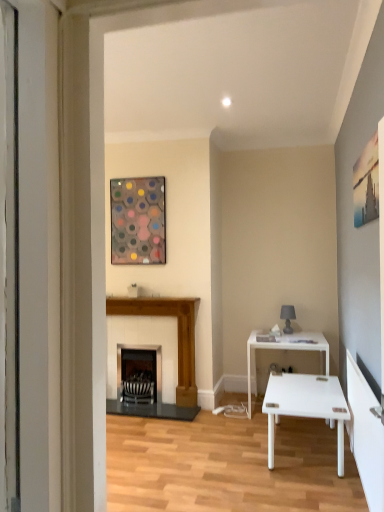
Question: Does matte gray lampshade at right have a greater width compared to black striped fireplace at center, the first fireplace positioned from the left?

Choices:
 (A) yes
 (B) no

Answer: (B)

Question: Is matte gray lampshade at right aimed at black striped fireplace at center, the first fireplace positioned from the left?

Choices:
 (A) yes
 (B) no

Answer: (B)

Question: Considering the relative sizes of matte gray lampshade at right and black striped fireplace at center, the first fireplace positioned from the left, in the image provided, is matte gray lampshade at right bigger than black striped fireplace at center, the first fireplace positioned from the left,?

Choices:
 (A) yes
 (B) no

Answer: (B)

Question: Is matte gray lampshade at right shorter than black striped fireplace at center, acting as the second fireplace starting from the right?

Choices:
 (A) no
 (B) yes

Answer: (B)

Question: From a real-world perspective, is matte gray lampshade at right on black striped fireplace at center, the first fireplace positioned from the left?

Choices:
 (A) yes
 (B) no

Answer: (A)

Question: Is matte gray lampshade at right positioned far away from black striped fireplace at center, the first fireplace positioned from the left?

Choices:
 (A) yes
 (B) no

Answer: (A)

Question: Is white glossy table at right wider than wooden fireplace at center, arranged as the 2th fireplace when viewed from the left?

Choices:
 (A) no
 (B) yes

Answer: (B)

Question: Is white glossy table at right further to the viewer compared to wooden fireplace at center, arranged as the 2th fireplace when viewed from the left?

Choices:
 (A) yes
 (B) no

Answer: (B)

Question: Is white glossy table at right positioned before wooden fireplace at center, which is counted as the 1th fireplace, starting from the right?

Choices:
 (A) yes
 (B) no

Answer: (A)

Question: Considering the relative sizes of white glossy table at right and wooden fireplace at center, which is counted as the 1th fireplace, starting from the right, in the image provided, is white glossy table at right smaller than wooden fireplace at center, which is counted as the 1th fireplace, starting from the right,?

Choices:
 (A) yes
 (B) no

Answer: (B)

Question: From the image's perspective, is white glossy table at right under wooden fireplace at center, arranged as the 2th fireplace when viewed from the left?

Choices:
 (A) no
 (B) yes

Answer: (B)

Question: Does white glossy table at right appear on the left side of wooden fireplace at center, which is counted as the 1th fireplace, starting from the right?

Choices:
 (A) no
 (B) yes

Answer: (A)

Question: From a real-world perspective, is matte gray lampshade at right physically above metallic hexagonal artwork at upper center?

Choices:
 (A) yes
 (B) no

Answer: (B)